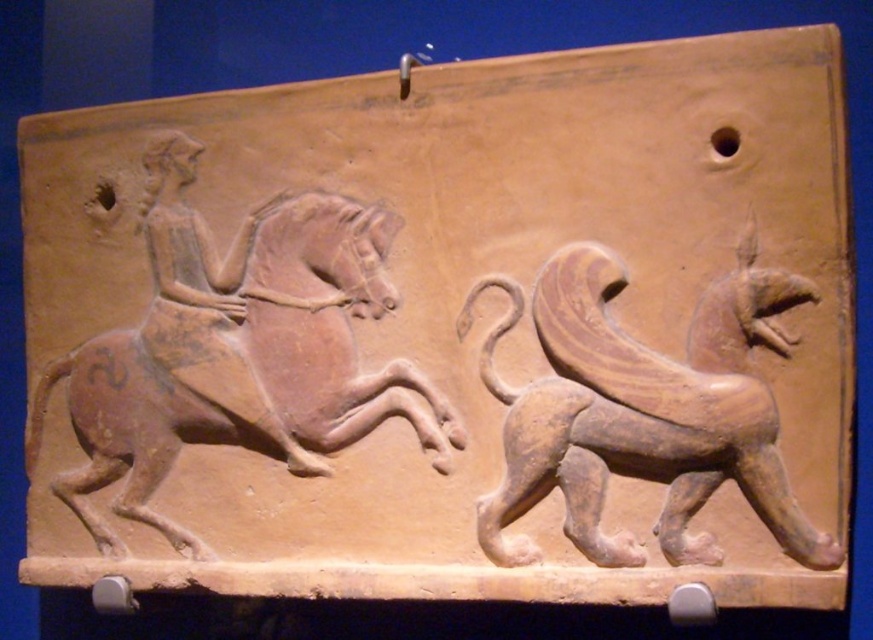
From the picture: You are a curator arranging an exhibition and need to place the earthenware horse at left and the brown clay lion at right in a display case. Based on their positions in the relief, which object should be placed to the east side of the display case if the lion is to the west?

The earthenware horse at left should be placed to the east side of the display case because it is positioned on the left side of the brown clay lion at right in the relief, and if the lion is to the west, the horse would naturally be to the east.

You are an archaeologist examining the ancient terracotta relief. You notice a point marked at coordinates (239, 360). Based on the relief description, which object does this point most likely correspond to?

The point at coordinates (239, 360) corresponds to the earthenware horse at left.

Based on the scene described, if you were to draw a vertical line down the center of the relief, which object would be closer to the top half of the image, the earthenware horse at left or the brown clay lion at right?

The earthenware horse at left is above the brown clay lion at right, so it would be closer to the top half of the image.